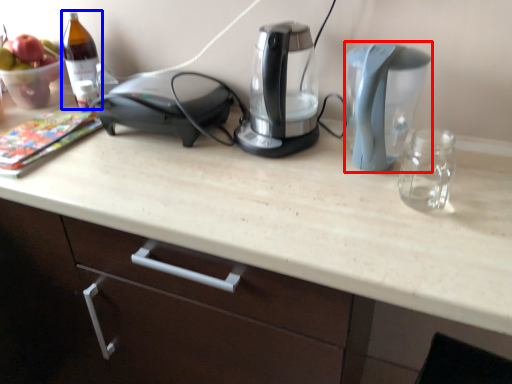
Question: Which of the following is the farthest to the observer, kitchen appliance (highlighted by a red box) or wine bottle (highlighted by a blue box)?

Choices:
 (A) kitchen appliance
 (B) wine bottle

Answer: (B)